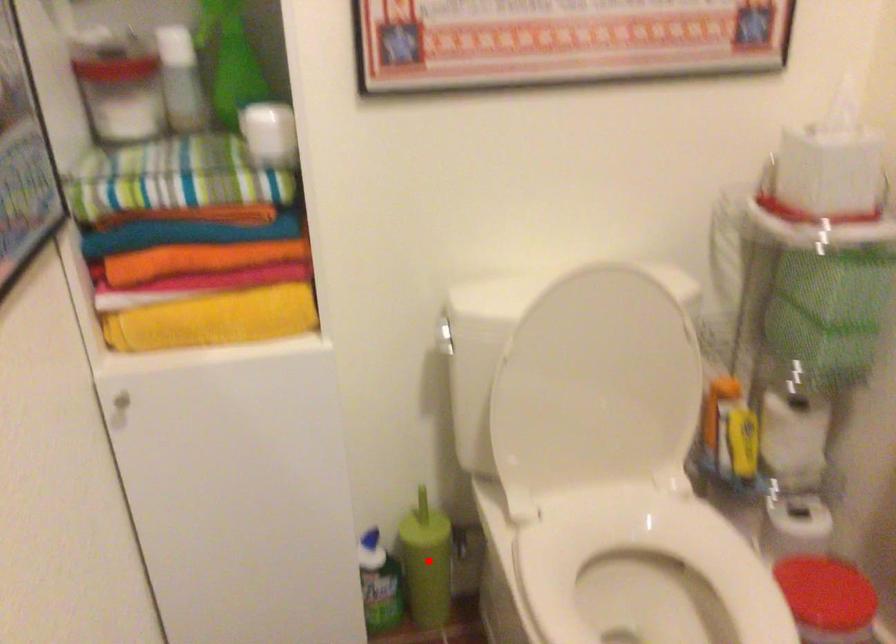
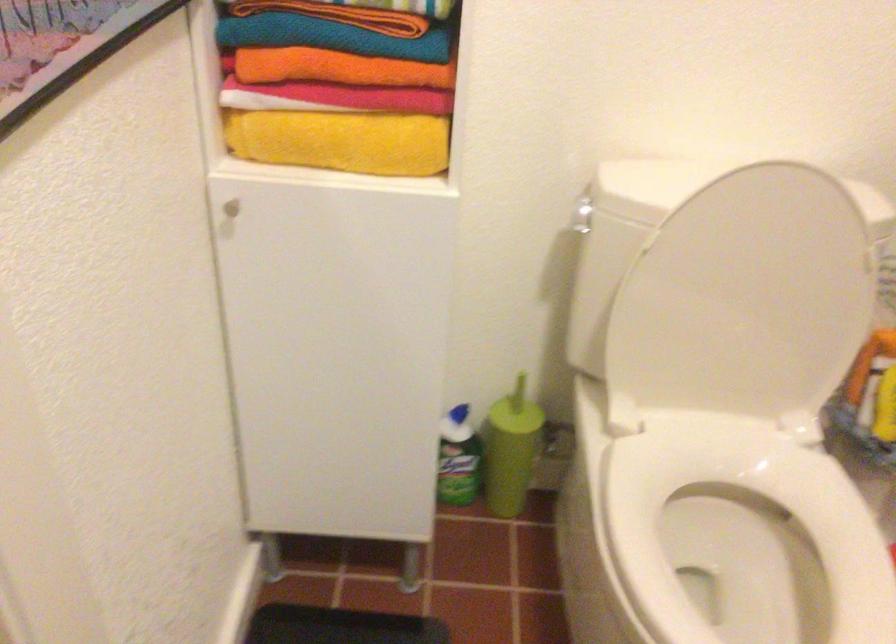
In the second image, find the point that corresponds to the highlighted location in the first image.

(511, 450)